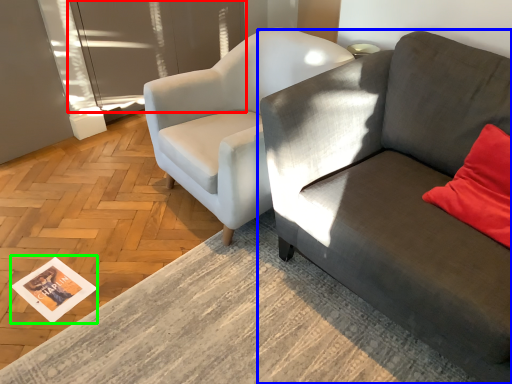
Question: Which object is the farthest from glass door (highlighted by a red box)? Choose among these: studio couch (highlighted by a blue box) or magazine (highlighted by a green box).

Choices:
 (A) studio couch
 (B) magazine

Answer: (A)